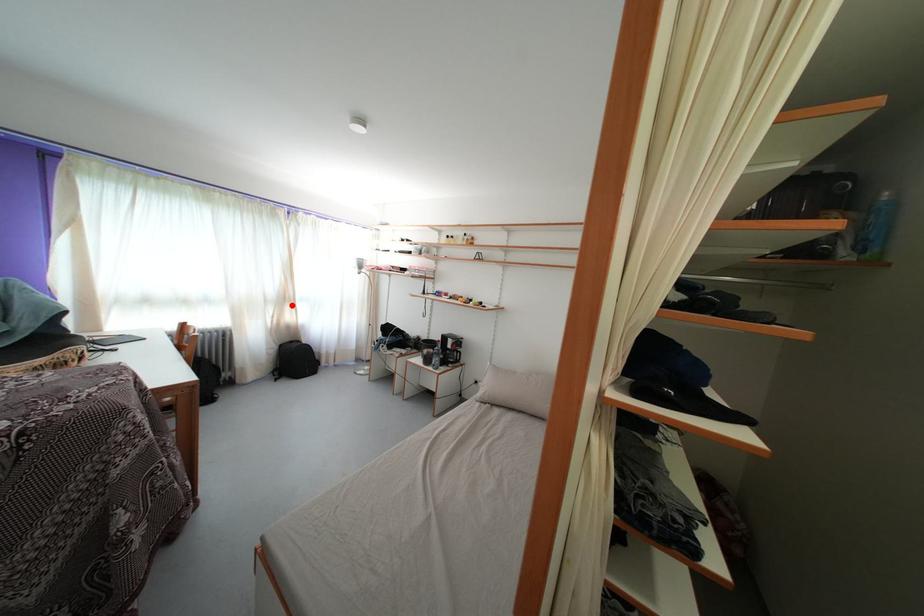
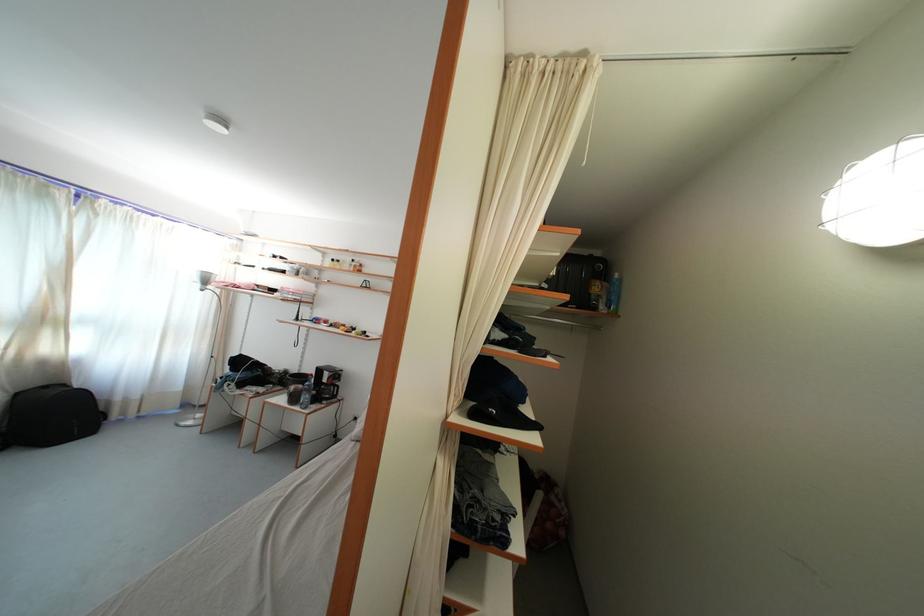
Where in the second image is the point corresponding to the highlighted location from the first image?

(52, 326)